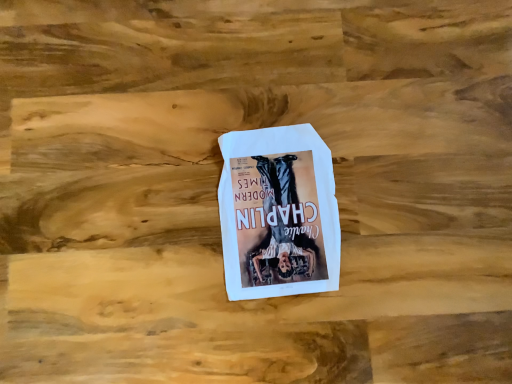
At what (x,y) coordinates should I click in order to perform the action: click on free space above white paper at center (from a real-world perspective). Please return your answer as a coordinate pair (x, y). Looking at the image, I should click on (280, 206).